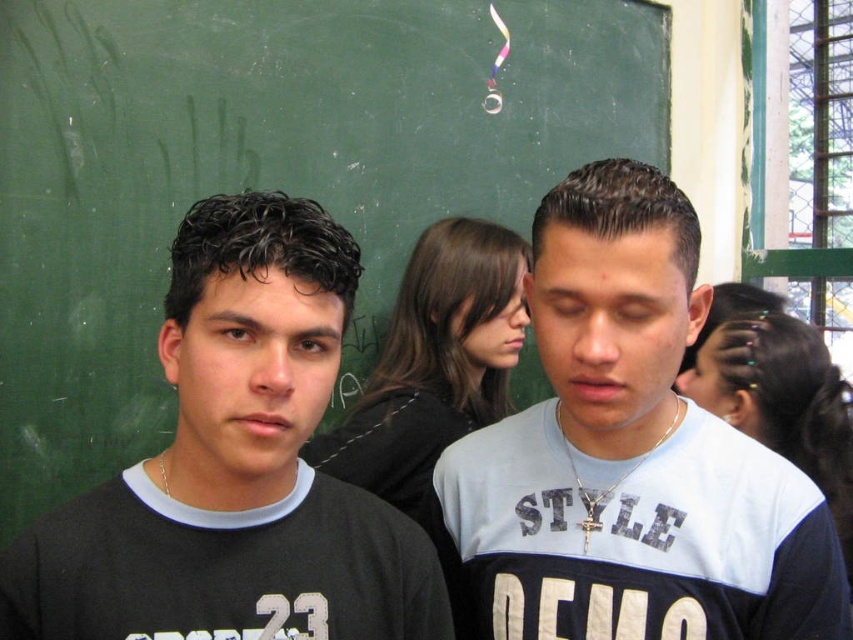
Question: Among these points, which one is farthest from the camera?

Choices:
 (A) (550, 589)
 (B) (320, 588)

Answer: (A)

Question: Does green chalkboard at upper center appear over black matte shirt at center?

Choices:
 (A) yes
 (B) no

Answer: (A)

Question: Which of the following is the farthest from the observer?

Choices:
 (A) green chalkboard at upper center
 (B) black matte shirt at center
 (C) white matte shirt at center

Answer: (A)

Question: Which object is farther from the camera taking this photo?

Choices:
 (A) black matte shirt at center
 (B) green chalkboard at upper center

Answer: (B)

Question: Does green chalkboard at upper center come in front of black matte shirt at center?

Choices:
 (A) yes
 (B) no

Answer: (B)

Question: Is white matte shirt at center bigger than black matte shirt at center?

Choices:
 (A) no
 (B) yes

Answer: (B)